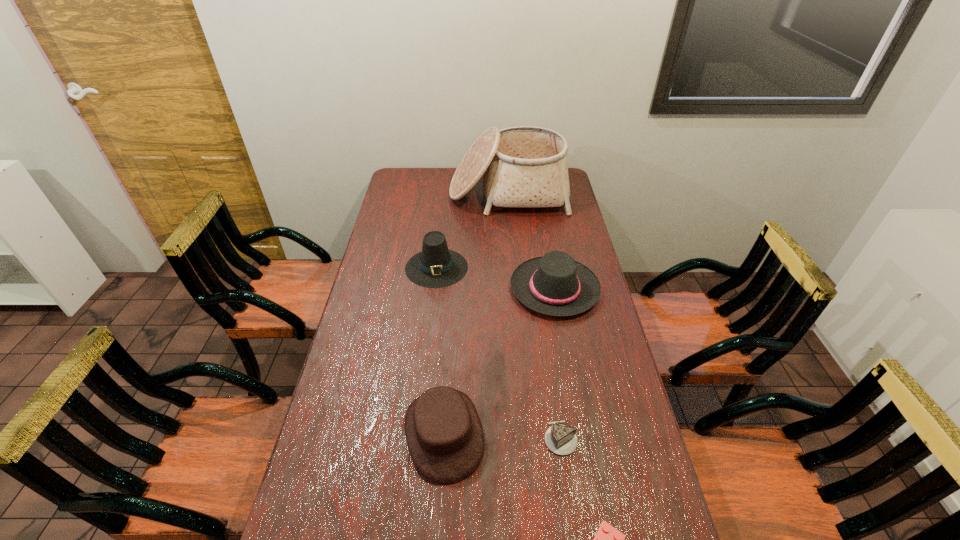
At what (x,y) coordinates should I click in order to perform the action: click on the farthest object. Please return your answer as a coordinate pair (x, y). The height and width of the screenshot is (540, 960). Looking at the image, I should click on (525, 166).

Where is `the tallest object`? This screenshot has height=540, width=960. the tallest object is located at coordinates (x=525, y=166).

The width and height of the screenshot is (960, 540). I want to click on the fifth shortest object, so click(436, 266).

Identify the location of the rightmost hat. (554, 284).

This screenshot has height=540, width=960. I want to click on the shortest hat, so click(443, 431).

Find the location of `the third shortest object`. the third shortest object is located at coordinates (443, 431).

Find the location of a particular element. Image resolution: width=960 pixels, height=540 pixels. the fifth tallest object is located at coordinates (560, 439).

Where is `vacant region located with the lid open on the basket`? This screenshot has height=540, width=960. vacant region located with the lid open on the basket is located at coordinates (514, 259).

Where is `free space located on the front-facing side of the fifth shortest object`? free space located on the front-facing side of the fifth shortest object is located at coordinates (427, 347).

This screenshot has height=540, width=960. Find the location of `free space located 0.130m on the back of the rightmost hat`. free space located 0.130m on the back of the rightmost hat is located at coordinates (546, 240).